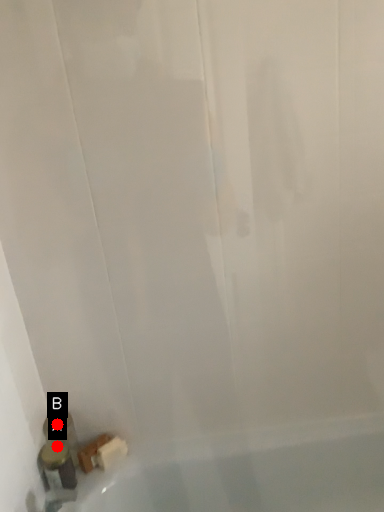
Question: Two points are circled on the image, labeled by A and B beside each circle. Which point is farther to the camera?

Choices:
 (A) A is further
 (B) B is further

Answer: (B)